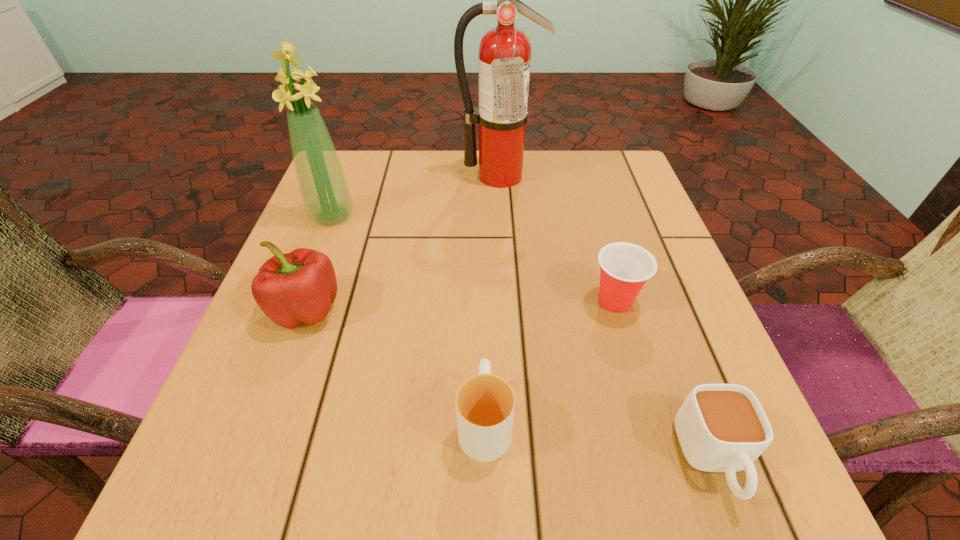
Identify the location of vacant area situated 0.280m on the left of the farthest cup. (432, 301).

In order to click on free space located 0.330m with the handle on the side of the leftmost cup in this screenshot , I will do `click(483, 244)`.

The width and height of the screenshot is (960, 540). I want to click on vacant space located 0.390m with the handle on the side of the leftmost cup, so click(483, 225).

Where is `free space located with the handle on the side of the leftmost cup`? The height and width of the screenshot is (540, 960). free space located with the handle on the side of the leftmost cup is located at coordinates (483, 267).

At what (x,y) coordinates should I click in order to perform the action: click on fire extinguisher that is positioned at the far edge. Please return your answer as a coordinate pair (x, y). Image resolution: width=960 pixels, height=540 pixels. Looking at the image, I should click on (505, 51).

Locate an element on the screen. The image size is (960, 540). bouquet located in the far edge section of the desktop is located at coordinates (324, 189).

This screenshot has width=960, height=540. In order to click on bouquet located at the left edge in this screenshot , I will do `click(324, 189)`.

Find the location of a particular element. The image size is (960, 540). bell pepper that is at the left edge is located at coordinates (293, 288).

What are the coordinates of `object located at the far left corner` in the screenshot? It's located at click(x=324, y=189).

You are a GUI agent. You are given a task and a screenshot of the screen. Output one action in this format:
    pyautogui.click(x=<x>, y=<y>)
    Task: Click on the object that is positioned at the near right corner
    
    Given the screenshot: What is the action you would take?
    pyautogui.click(x=721, y=427)